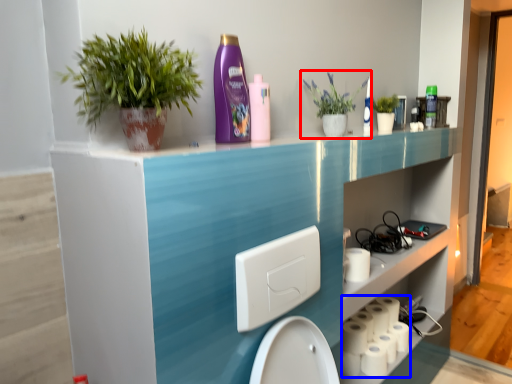
Question: Which of the following is the farthest to the observer, houseplant (highlighted by a red box) or toilet paper (highlighted by a blue box)?

Choices:
 (A) houseplant
 (B) toilet paper

Answer: (B)